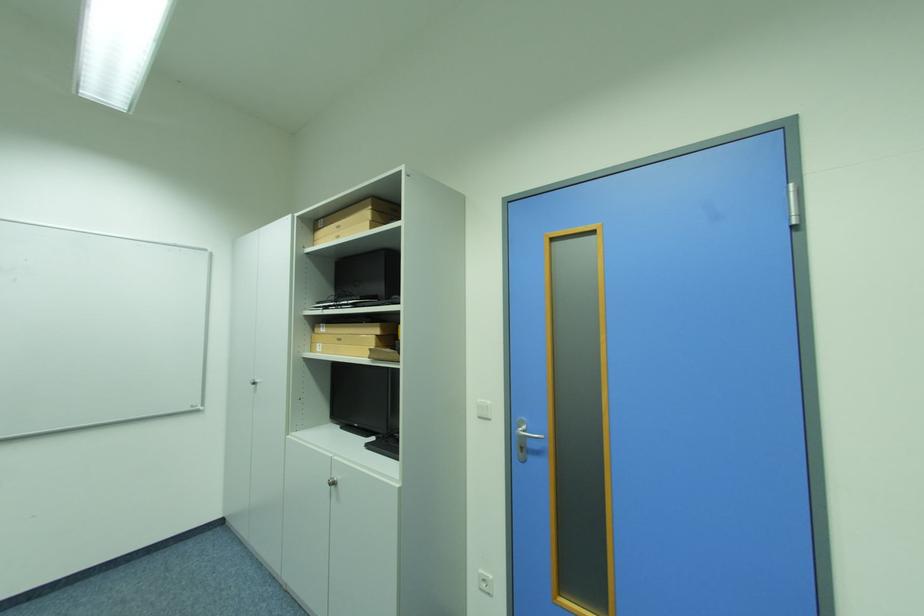
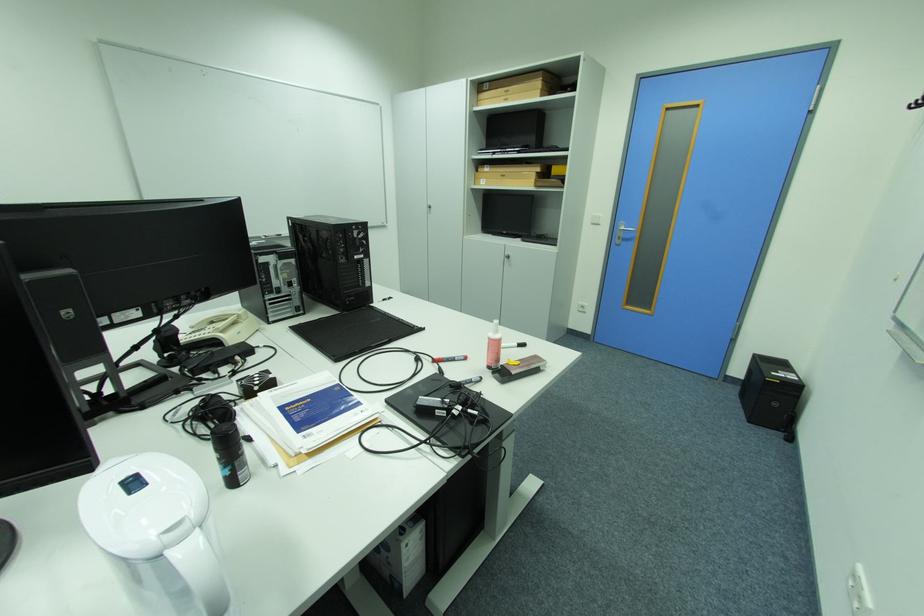
In a continuous first-person perspective shot, in which direction is the camera moving?

The movement direction of the cameraman is left, backward.